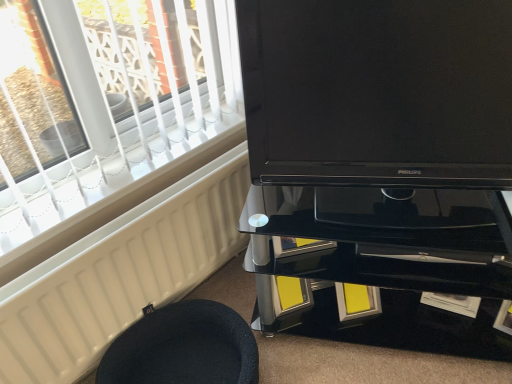
At what (x,y) coordinates should I click in order to perform the action: click on vacant space in matte black tv at center (from a real-world perspective). Please return your answer as a coordinate pair (x, y). This screenshot has height=384, width=512. Looking at the image, I should click on (381, 212).